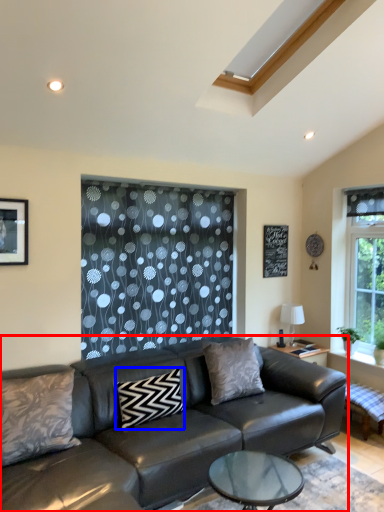
Question: Among these objects, which one is farthest to the camera, studio couch (highlighted by a red box) or pillow (highlighted by a blue box)?

Choices:
 (A) studio couch
 (B) pillow

Answer: (B)